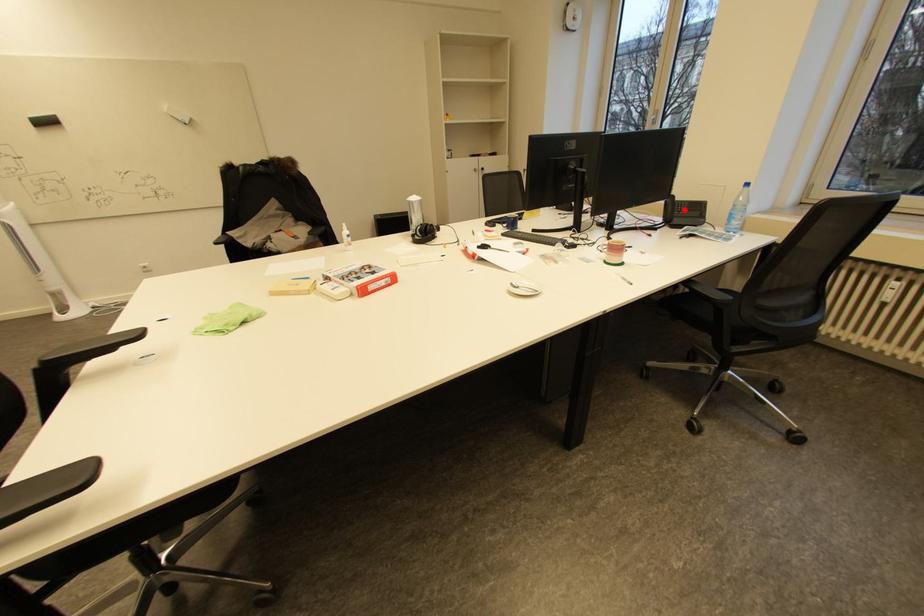
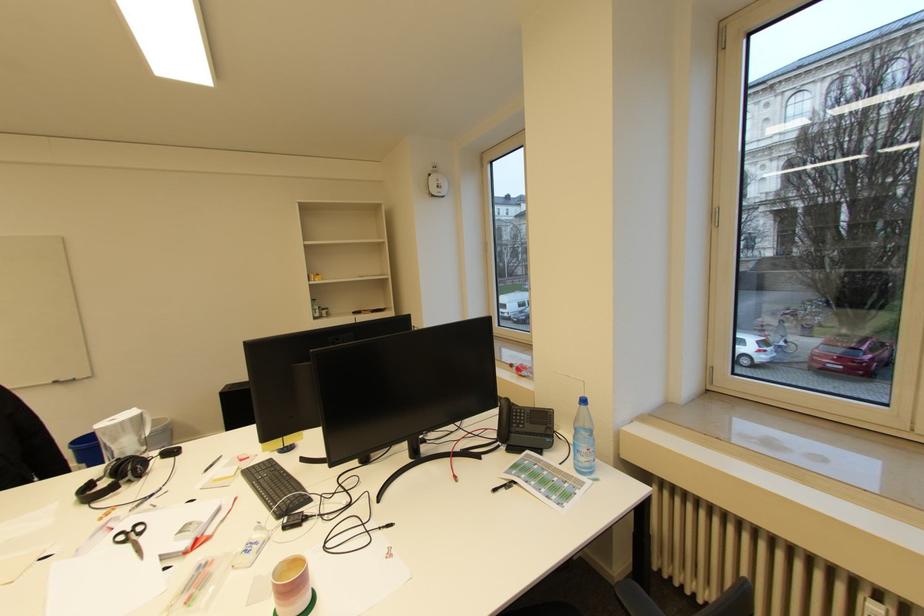
Question: I am providing you with two images of the same scene from different viewpoints. In image1, a red point is highlighted. Considering the same 3D point in image2, which of the following is correct?

Choices:
 (A) It is closer
 (B) It is farther

Answer: (B)